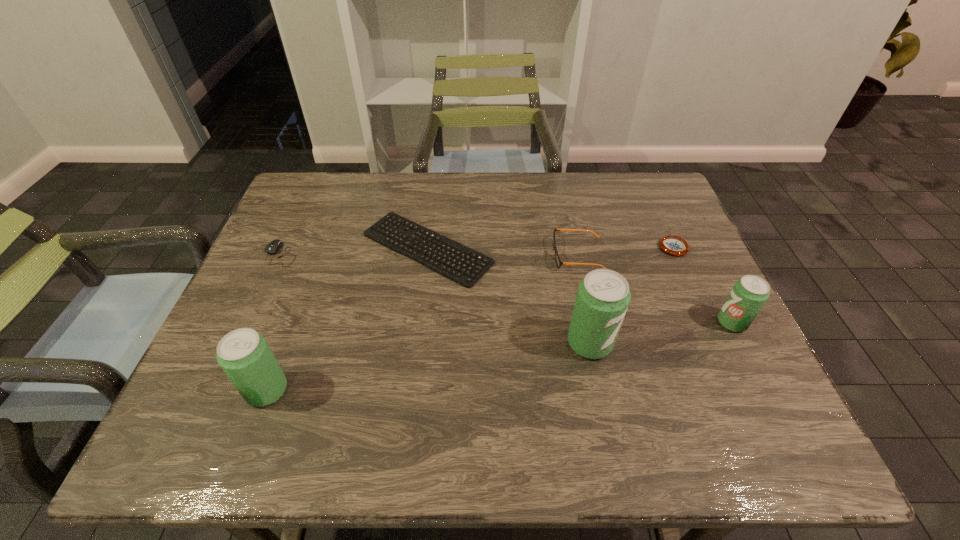
You are a GUI agent. You are given a task and a screenshot of the screen. Output one action in this format:
    pyautogui.click(x=<x>, y=<y>)
    Task: Click on the leftmost soda
    The width and height of the screenshot is (960, 540).
    Given the screenshot: What is the action you would take?
    pyautogui.click(x=245, y=356)

Locate an element on the screen. the sixth shortest object is located at coordinates (245, 356).

The height and width of the screenshot is (540, 960). Find the location of `the second soda from right to left`. the second soda from right to left is located at coordinates (603, 296).

Locate an element on the screen. This screenshot has height=540, width=960. the tallest soda is located at coordinates (603, 296).

At what (x,y) coordinates should I click in order to perform the action: click on the shortest soda. Please return your answer as a coordinate pair (x, y). Looking at the image, I should click on (749, 294).

This screenshot has width=960, height=540. In order to click on the rightmost soda in this screenshot , I will do `click(749, 294)`.

This screenshot has height=540, width=960. In order to click on computer keyboard in this screenshot , I will do `click(385, 225)`.

Where is `the shortest object`? The image size is (960, 540). the shortest object is located at coordinates [x=385, y=225].

Where is `the leftmost object`? the leftmost object is located at coordinates (272, 248).

Where is `spectacles`? The height and width of the screenshot is (540, 960). spectacles is located at coordinates (558, 261).